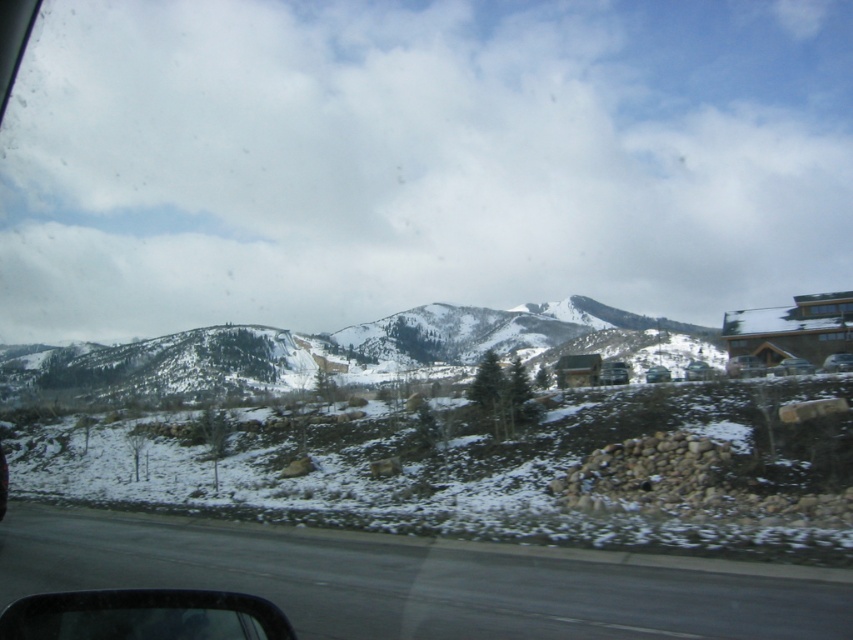
Question: Can you confirm if metallic silver car at right is wider than metallic silver car at center-right?

Choices:
 (A) no
 (B) yes

Answer: (A)

Question: Does black asphalt highway at lower center have a larger size compared to transparent glass car window at lower left?

Choices:
 (A) no
 (B) yes

Answer: (B)

Question: Which object is closer to the camera taking this photo?

Choices:
 (A) metallic silver car at right
 (B) black asphalt highway at lower center
 (C) metallic gray car at lower left
 (D) transparent glass car window at lower left

Answer: (D)

Question: Among these points, which one is farthest from the camera?

Choices:
 (A) (352, 557)
 (B) (787, 371)

Answer: (B)

Question: Which of these objects is positioned farthest from the metallic silver car at right?

Choices:
 (A) black asphalt highway at lower center
 (B) matte silver car at right

Answer: (A)

Question: Can you confirm if metallic silver car at right is wider than metallic silver car at center-right?

Choices:
 (A) no
 (B) yes

Answer: (A)